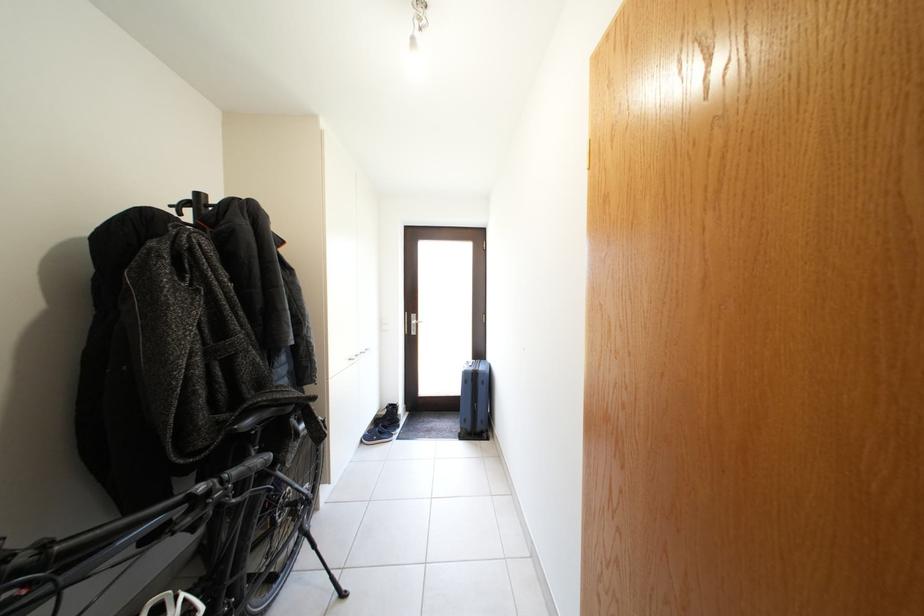
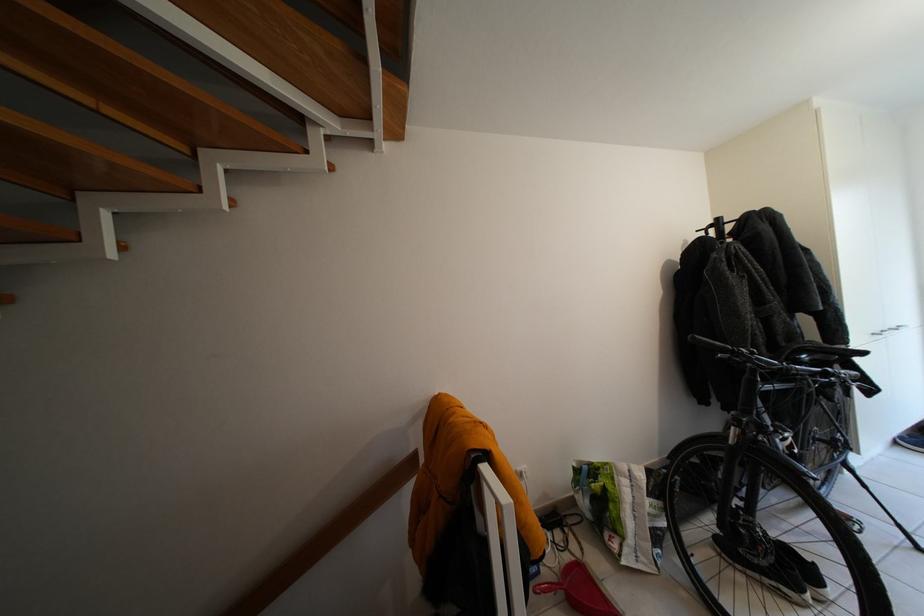
Where in the second image is the point corresponding to point 297,410 from the first image?

(841, 360)